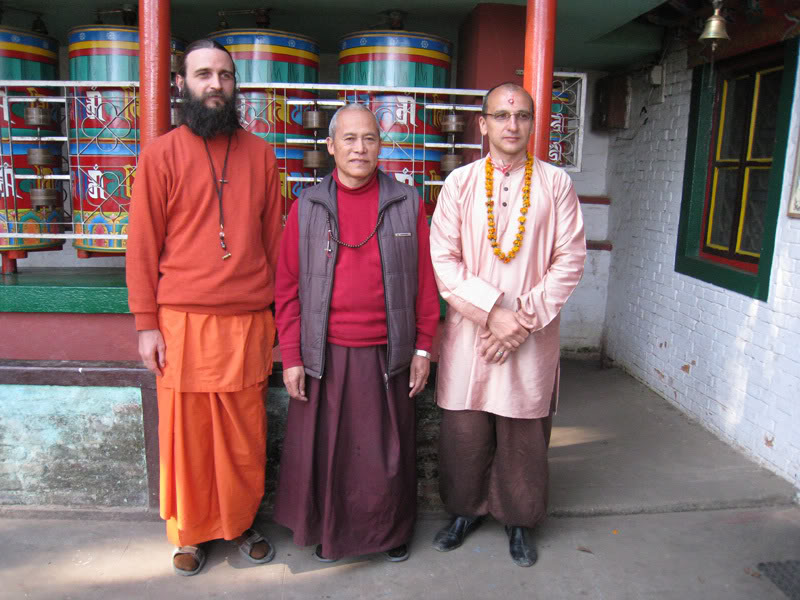
Find the location of a particular element. The height and width of the screenshot is (600, 800). window is located at coordinates (756, 196).